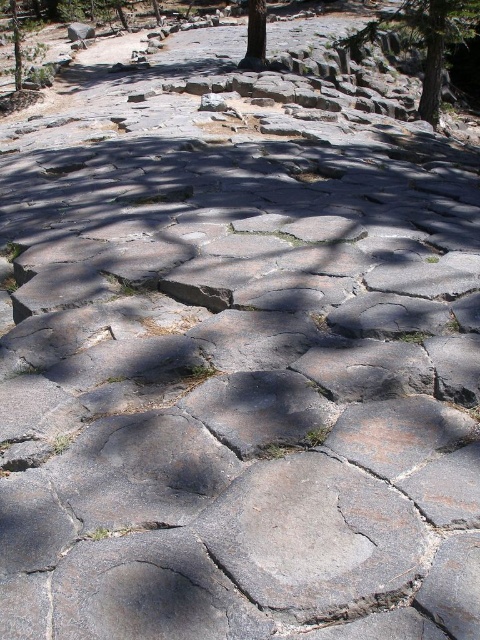
Does brown rough bark tree at upper center have a larger size compared to green textured tree at upper left?

No.

Who is lower down, brown rough bark tree at upper center or green textured tree at upper left?

Positioned lower is brown rough bark tree at upper center.

You are a GUI agent. You are given a task and a screenshot of the screen. Output one action in this format:
    pyautogui.click(x=<x>, y=<y>)
    Task: Click on the brown rough bark tree at upper center
    
    Given the screenshot: What is the action you would take?
    pyautogui.click(x=255, y=35)

Who is taller, green textured tree at upper right or brown rough bark tree at upper center?

green textured tree at upper right

The image size is (480, 640). I want to click on green textured tree at upper right, so click(425, 38).

Does point (369, 33) come behind point (256, 36)?

Yes, it is.

Where is `green textured tree at upper right`? This screenshot has height=640, width=480. green textured tree at upper right is located at coordinates [425, 38].

Who is shorter, green textured tree at upper right or green textured tree at upper left?

Standing shorter between the two is green textured tree at upper right.

Looking at this image, is green textured tree at upper right above green textured tree at upper left?

Incorrect, green textured tree at upper right is not positioned above green textured tree at upper left.

Who is more forward, [457,16] or [19,49]?

Point [457,16]

The image size is (480, 640). What are the coordinates of `green textured tree at upper right` in the screenshot? It's located at 425,38.